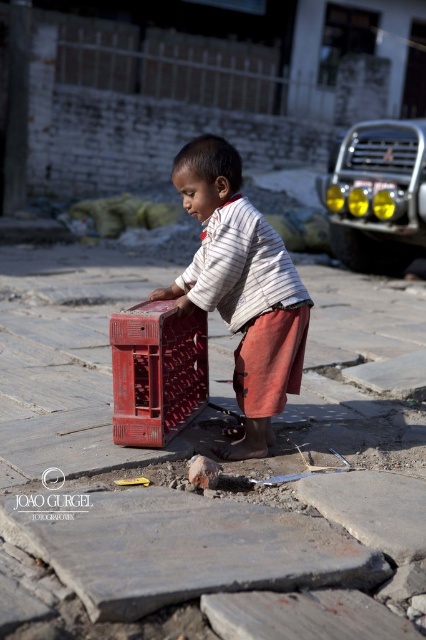
Is matte plastic crate at center to the right of matte plastic basket at center from the viewer's perspective?

Indeed, matte plastic crate at center is positioned on the right side of matte plastic basket at center.

Is point (275, 312) positioned in front of point (181, 412)?

Yes, point (275, 312) is in front of point (181, 412).

Is point (216, 237) more distant than point (141, 330)?

Yes, it is behind point (141, 330).

Identify the location of matte plastic crate at center. (241, 288).

Is smooth stone pavement at center positioned behind matte plastic basket at center?

Yes, smooth stone pavement at center is behind matte plastic basket at center.

Is smooth stone pavement at center below matte plastic basket at center?

Indeed, smooth stone pavement at center is positioned under matte plastic basket at center.

I want to click on smooth stone pavement at center, so coord(207,490).

I want to click on smooth stone pavement at center, so click(207, 490).

Which is below, smooth stone pavement at center or matte plastic crate at center?

Positioned lower is smooth stone pavement at center.

Is point (340, 582) positioned before point (253, 262)?

Yes, point (340, 582) is closer to viewer.

Image resolution: width=426 pixels, height=640 pixels. Describe the element at coordinates (207, 490) in the screenshot. I see `smooth stone pavement at center` at that location.

Locate an element on the screen. This screenshot has height=640, width=426. smooth stone pavement at center is located at coordinates (207, 490).